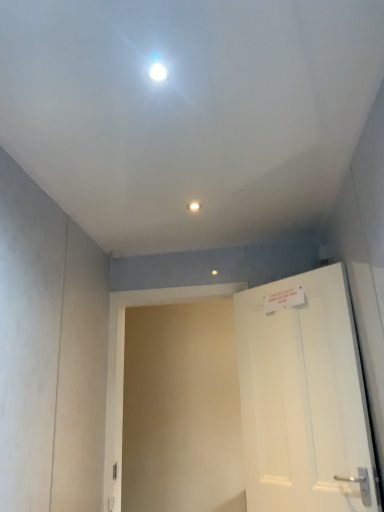
Question: Is white matte door at right thinner than matte white light fixture at center?

Choices:
 (A) yes
 (B) no

Answer: (B)

Question: Does white matte door at right have a greater width compared to matte white light fixture at center?

Choices:
 (A) yes
 (B) no

Answer: (A)

Question: Is white matte door at right facing towards matte white light fixture at center?

Choices:
 (A) no
 (B) yes

Answer: (A)

Question: From the image's perspective, is white matte door at right located beneath matte white light fixture at center?

Choices:
 (A) yes
 (B) no

Answer: (A)

Question: From the image's perspective, would you say white matte door at right is positioned over matte white light fixture at center?

Choices:
 (A) no
 (B) yes

Answer: (A)

Question: Can you confirm if white matte door at right is bigger than matte white light fixture at center?

Choices:
 (A) yes
 (B) no

Answer: (A)

Question: Is matte white light fixture at center positioned with its back to white matte door at right?

Choices:
 (A) no
 (B) yes

Answer: (A)

Question: Is matte white light fixture at center not within white matte door at right?

Choices:
 (A) no
 (B) yes

Answer: (B)

Question: From a real-world perspective, is matte white light fixture at center below white matte door at right?

Choices:
 (A) no
 (B) yes

Answer: (A)

Question: Is white matte door at right a part of matte white light fixture at center?

Choices:
 (A) no
 (B) yes

Answer: (A)

Question: Considering the relative sizes of matte white light fixture at center and white matte door at right in the image provided, is matte white light fixture at center wider than white matte door at right?

Choices:
 (A) no
 (B) yes

Answer: (A)

Question: From the image's perspective, is matte white light fixture at center on white matte door at right?

Choices:
 (A) yes
 (B) no

Answer: (A)

Question: Is white matte door at right in front of or behind matte white light fixture at center in the image?

Choices:
 (A) behind
 (B) front

Answer: (B)